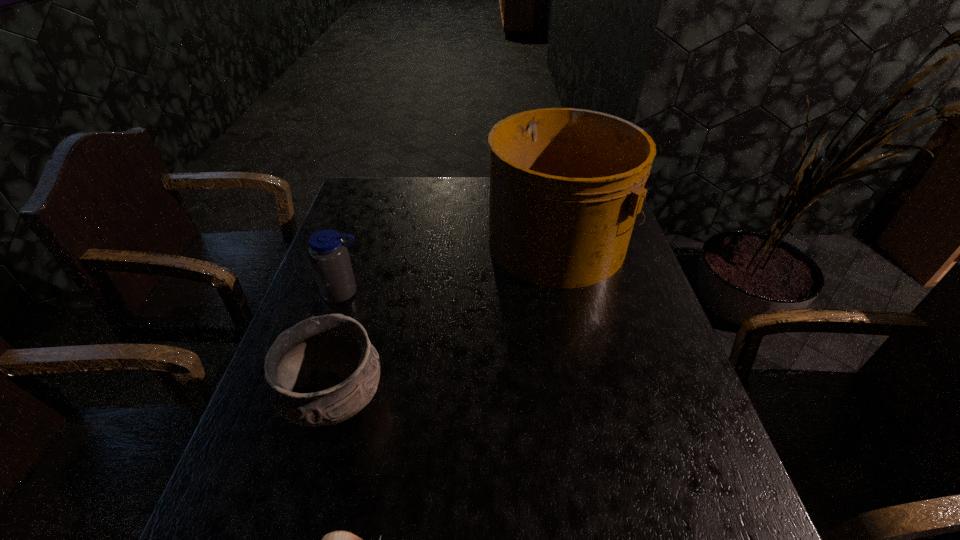
Identify the location of object that stands as the third closest to the water bottle. (337, 539).

Identify which object is the third closest to the water bottle. Please provide its 2D coordinates. Your answer should be formatted as a tuple, i.e. [(x, y)], where the tuple contains the x and y coordinates of a point satisfying the conditions above.

[(337, 539)]

You are a GUI agent. You are given a task and a screenshot of the screen. Output one action in this format:
    pyautogui.click(x=<x>, y=<y>)
    Task: Click on the vacant space that satisfies the following two spatial constraints: 1. on the back side of the bucket; 2. on the left side of the pottery
    The height and width of the screenshot is (540, 960).
    Given the screenshot: What is the action you would take?
    pyautogui.click(x=379, y=241)